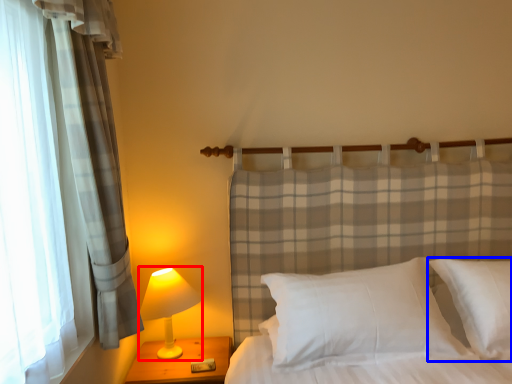
Question: Which of the following is the farthest to the observer, lamp (highlighted by a red box) or pillow (highlighted by a blue box)?

Choices:
 (A) lamp
 (B) pillow

Answer: (A)